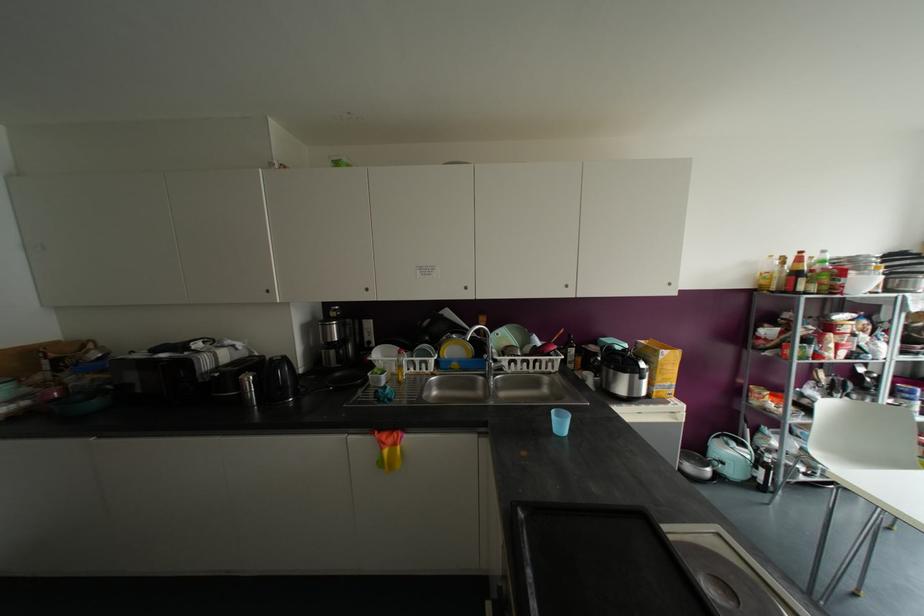
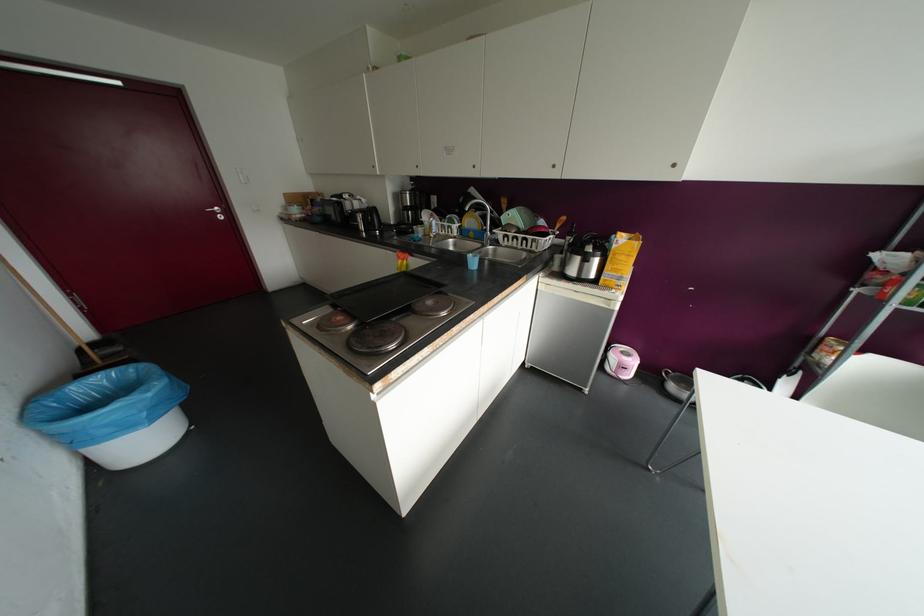
The point at (565, 286) is marked in the first image. Where is the corresponding point in the second image?

(553, 166)